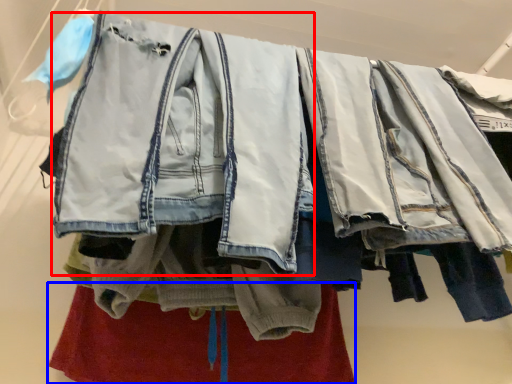
Question: Which object is further to the camera taking this photo, denim jacket (highlighted by a red box) or underclothes (highlighted by a blue box)?

Choices:
 (A) denim jacket
 (B) underclothes

Answer: (B)